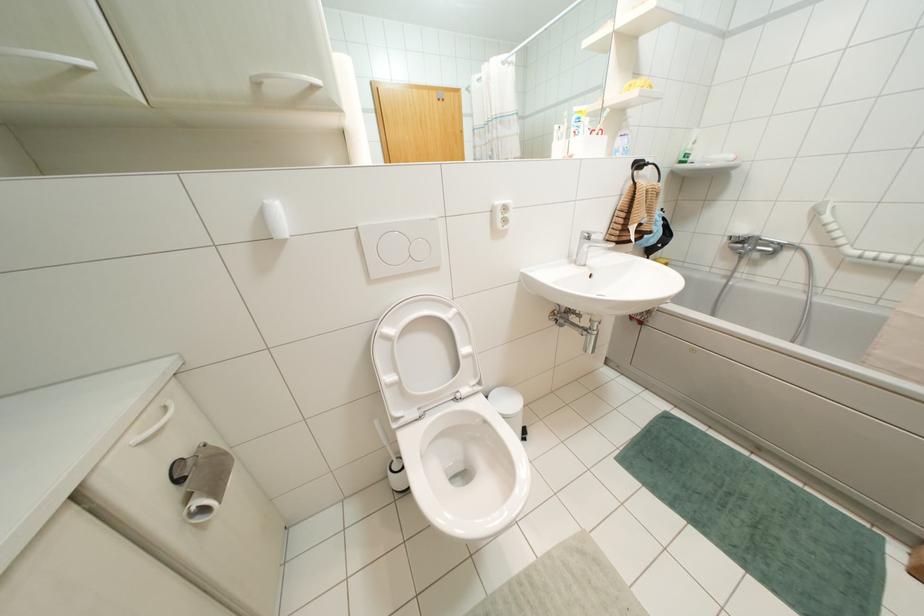
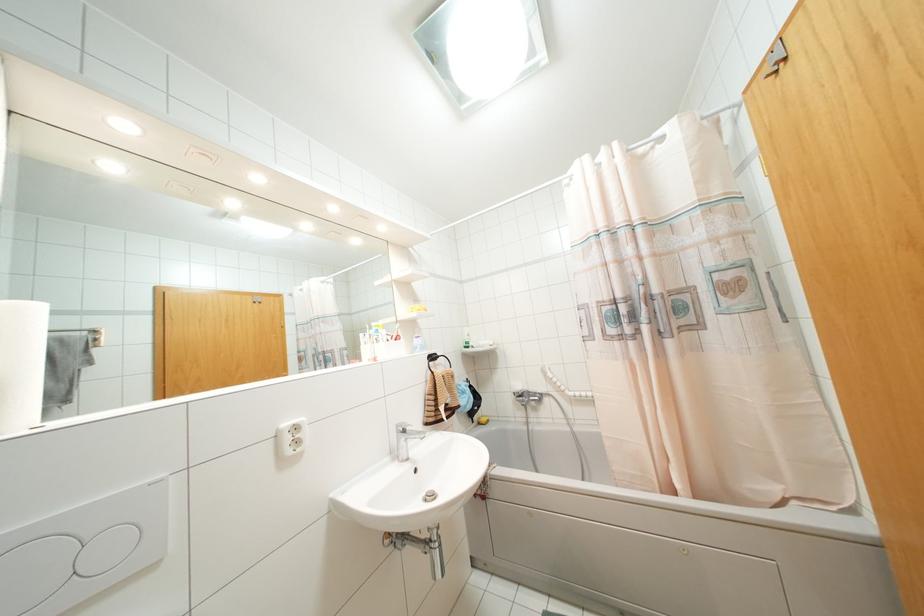
Where in the second image is the point corresponding to pixel 505 220 from the first image?

(297, 442)